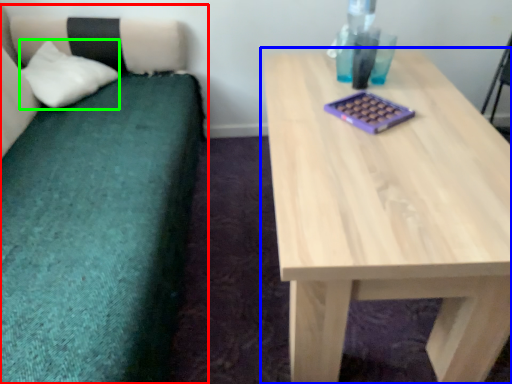
Question: Based on their relative distances, which object is farther from studio couch (highlighted by a red box)? Choose from table (highlighted by a blue box) and pillow (highlighted by a green box).

Choices:
 (A) table
 (B) pillow

Answer: (A)